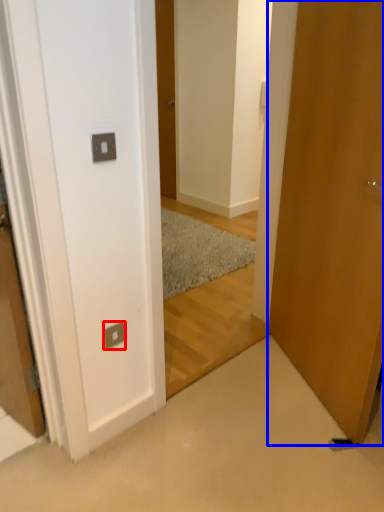
Question: Which object appears farthest to the camera in this image, electric outlet (highlighted by a red box) or door (highlighted by a blue box)?

Choices:
 (A) electric outlet
 (B) door

Answer: (A)